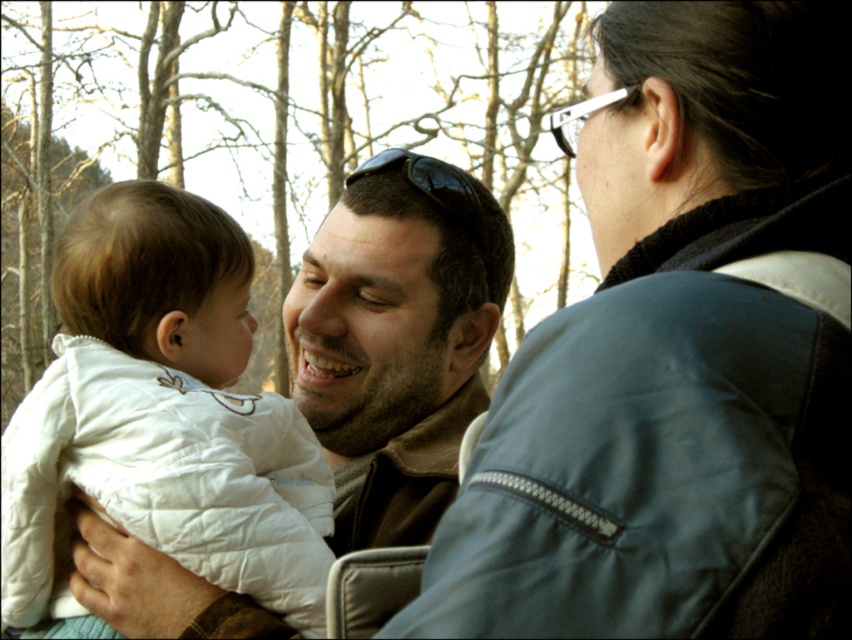
You are a photographer trying to capture a candid shot of the man and baby. You notice the blue leather jacket at center and the black matte sunglasses at center in the scene. Which object should you avoid blocking if you want to keep the man and baby visible in your photo?

You should avoid blocking the blue leather jacket at center because it is positioned to the right of the black matte sunglasses at center, so blocking the jacket might obscure the man and baby more than blocking the sunglasses.

You are a fashion designer observing the scene and want to create a new jacket design that balances the features of both the blue leather jacket at center and the white quilted jacket at left. Considering their sizes, which jacket should you use as the base for the width to ensure the new design isn

The blue leather jacket at center has a lesser width compared to the white quilted jacket at left. To balance the features, you should use the white quilted jacket at left as the base for the width since it is wider, allowing the new design to incorporate both the style of the blue leather jacket and the broader silhouette of the white quilted jacket.

You are a photographer standing at the center of the scene. You want to take a photo of the blue leather jacket at center and the black matte sunglasses at center. If your camera has a maximum focus range of 7 feet, will both objects be in focus?

The blue leather jacket at center is 7.47 feet away from the black matte sunglasses at center. Since the maximum focus range is 7 feet, the distance between them exceeds this limit, so both objects cannot be in focus simultaneously.